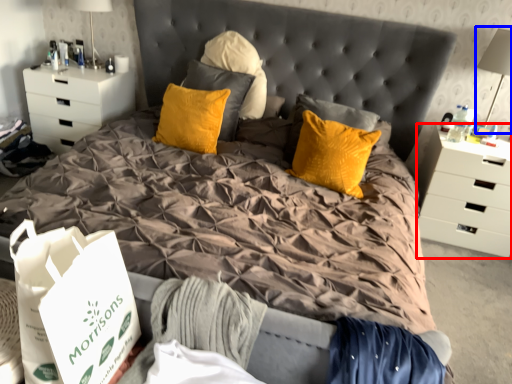
Question: Which point is closer to the camera, chest of drawers (highlighted by a red box) or table lamp (highlighted by a blue box)?

Choices:
 (A) chest of drawers
 (B) table lamp

Answer: (B)